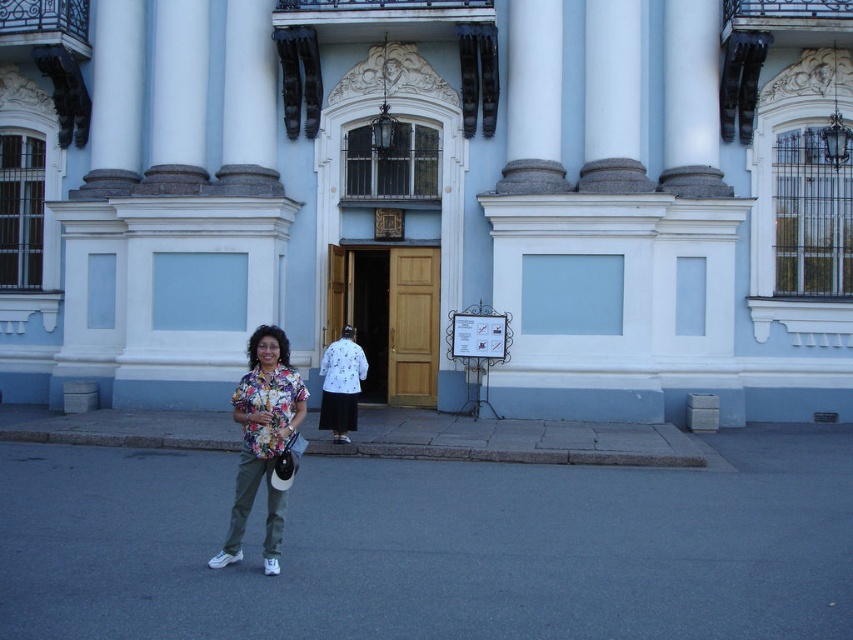
Is point (264, 83) behind point (334, 401)?

Yes, it is.

Can you confirm if white marble column at upper left is taller than white dotted shirt at center?

Indeed, white marble column at upper left has a greater height compared to white dotted shirt at center.

Is point (260, 8) positioned in front of point (340, 422)?

No, it is behind (340, 422).

Locate an element on the screen. The image size is (853, 640). white marble column at upper left is located at coordinates (248, 84).

Between floral print shirt at center and white marble column at upper left, which one is positioned lower?

floral print shirt at center

Based on the photo, is floral print shirt at center shorter than white marble column at upper left?

Correct, floral print shirt at center is not as tall as white marble column at upper left.

Is point (267, 506) positioned before point (271, 92)?

Yes, it is in front of point (271, 92).

This screenshot has height=640, width=853. What are the coordinates of `floral print shirt at center` in the screenshot? It's located at (262, 440).

You are a GUI agent. You are given a task and a screenshot of the screen. Output one action in this format:
    pyautogui.click(x=<x>, y=<y>)
    Task: Click on the floral print shirt at center
    The height and width of the screenshot is (640, 853).
    Given the screenshot: What is the action you would take?
    pyautogui.click(x=262, y=440)

Which of these two, floral print shirt at center or white dotted shirt at center, stands shorter?

white dotted shirt at center

Identify the location of floral print shirt at center. (262, 440).